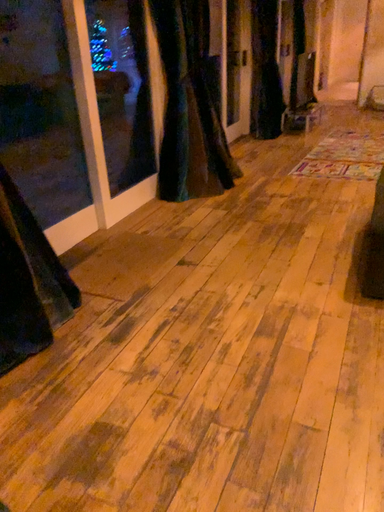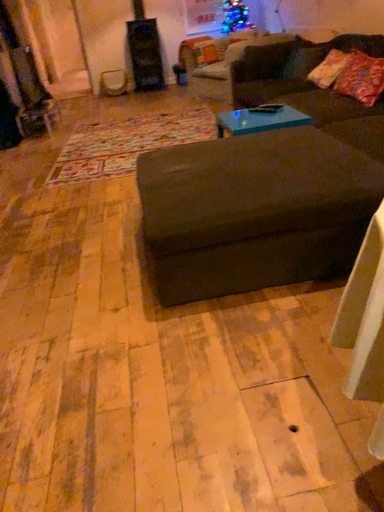
Question: How did the camera likely rotate when shooting the video?

Choices:
 (A) rotated right
 (B) rotated left

Answer: (A)